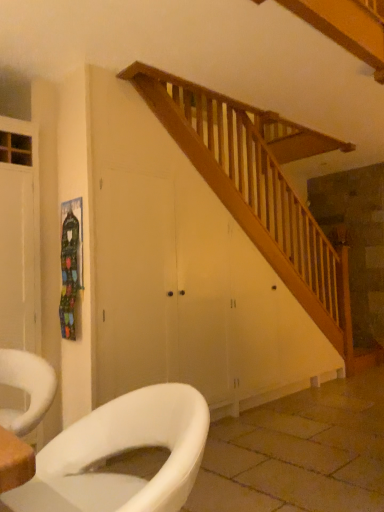
Question: Is white glossy toilet at lower left outside white glossy toilet at lower left?

Choices:
 (A) yes
 (B) no

Answer: (A)

Question: Considering the relative sizes of white glossy toilet at lower left and white glossy toilet at lower left in the image provided, is white glossy toilet at lower left smaller than white glossy toilet at lower left?

Choices:
 (A) yes
 (B) no

Answer: (A)

Question: From the image's perspective, is white glossy toilet at lower left above white glossy toilet at lower left?

Choices:
 (A) yes
 (B) no

Answer: (A)

Question: From a real-world perspective, is white glossy toilet at lower left physically below white glossy toilet at lower left?

Choices:
 (A) no
 (B) yes

Answer: (A)

Question: Is white glossy toilet at lower left completely or partially inside white glossy toilet at lower left?

Choices:
 (A) no
 (B) yes

Answer: (A)

Question: From the image's perspective, does white glossy toilet at lower left appear lower than white glossy toilet at lower left?

Choices:
 (A) no
 (B) yes

Answer: (A)

Question: Is white glossy toilet at lower left smaller than white glossy toilet at lower left?

Choices:
 (A) yes
 (B) no

Answer: (B)

Question: Is white glossy toilet at lower left oriented towards white glossy toilet at lower left?

Choices:
 (A) yes
 (B) no

Answer: (B)

Question: Is white glossy toilet at lower left oriented away from white glossy toilet at lower left?

Choices:
 (A) yes
 (B) no

Answer: (B)

Question: Is white glossy toilet at lower left taller than white glossy toilet at lower left?

Choices:
 (A) yes
 (B) no

Answer: (B)

Question: Is white glossy toilet at lower left outside white glossy toilet at lower left?

Choices:
 (A) no
 (B) yes

Answer: (B)

Question: From the image's perspective, is white glossy toilet at lower left beneath white glossy toilet at lower left?

Choices:
 (A) no
 (B) yes

Answer: (B)

Question: From a real-world perspective, relative to white glossy toilet at lower left, is white glossy toilet at lower left vertically above or below?

Choices:
 (A) below
 (B) above

Answer: (B)